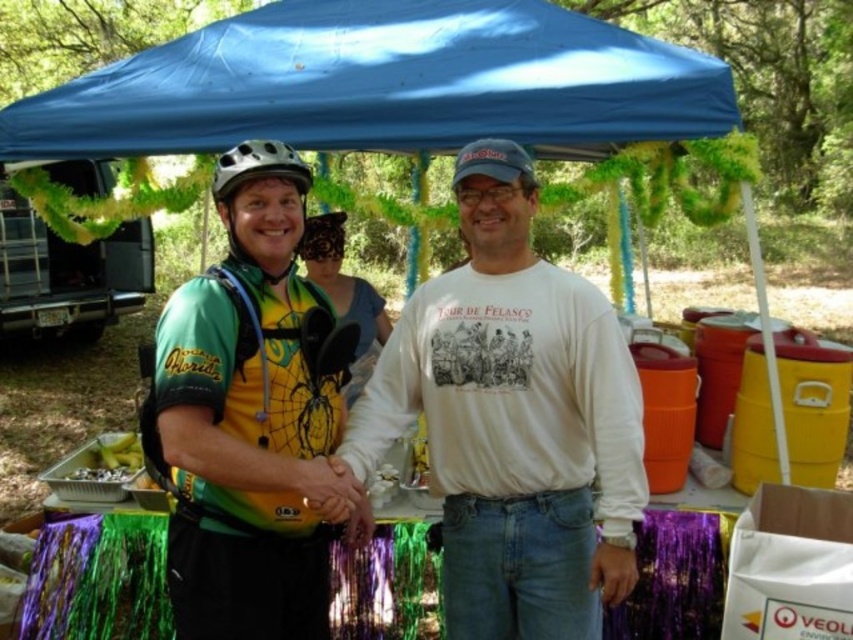
Question: Estimate the real-world distances between objects in this image. Which object is farther from the white matte bicycle helmet at upper left?

Choices:
 (A) patterned fabric headscarf at center
 (B) matte black helmet at center

Answer: (A)

Question: Is white cotton shirt at center to the left of blue fabric canopy at upper center from the viewer's perspective?

Choices:
 (A) yes
 (B) no

Answer: (B)

Question: In this image, where is patterned fabric headscarf at center located relative to matte black helmet at center?

Choices:
 (A) left
 (B) right

Answer: (B)

Question: Does patterned fabric headscarf at center have a lesser width compared to white matte bicycle helmet at upper left?

Choices:
 (A) no
 (B) yes

Answer: (A)

Question: Which object is the closest to the matte black helmet at center?

Choices:
 (A) white matte bicycle helmet at upper left
 (B) white cotton shirt at center

Answer: (A)

Question: Which of the following is the closest to the observer?

Choices:
 (A) matte black helmet at center
 (B) white matte bicycle helmet at upper left
 (C) blue fabric canopy at upper center
 (D) patterned fabric headscarf at center

Answer: (B)